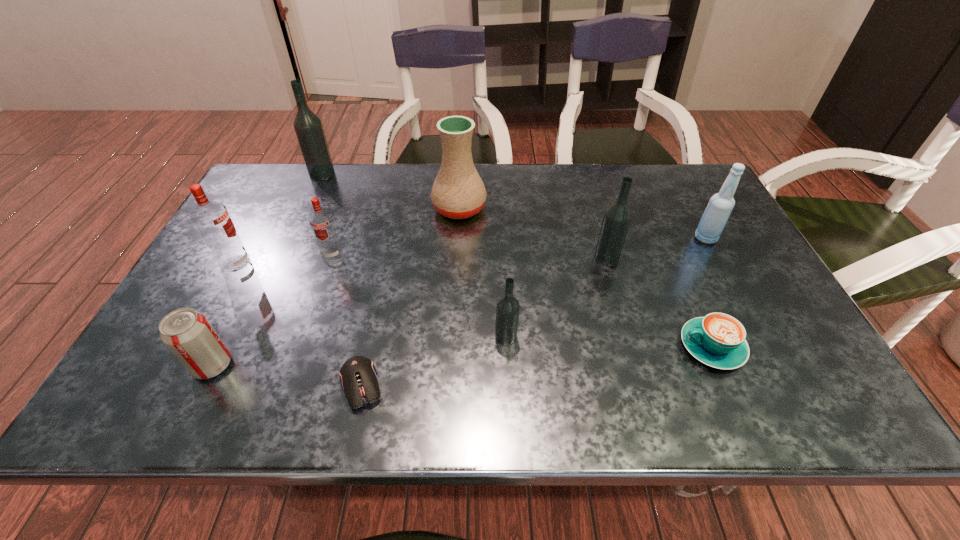
This screenshot has height=540, width=960. Find the location of `the farthest vodka`. the farthest vodka is located at coordinates (308, 127).

At what (x,y) coordinates should I click in order to perform the action: click on the tallest vodka. Please return your answer as a coordinate pair (x, y). The width and height of the screenshot is (960, 540). Looking at the image, I should click on (308, 127).

This screenshot has width=960, height=540. Find the location of `pottery`. pottery is located at coordinates (458, 192).

At what (x,y) coordinates should I click in order to perform the action: click on the ninth nearest object. Please return your answer as a coordinate pair (x, y). This screenshot has width=960, height=540. Looking at the image, I should click on (458, 192).

What are the coordinates of `the rightmost vodka` in the screenshot? It's located at (617, 217).

This screenshot has height=540, width=960. I want to click on the rightmost black vodka, so click(x=617, y=217).

Where is `the leftmost vodka`? the leftmost vodka is located at coordinates (212, 219).

Where is `the left red vodka`? the left red vodka is located at coordinates (212, 219).

I want to click on bottle, so 720,206.

Image resolution: width=960 pixels, height=540 pixels. I want to click on the rightmost object, so click(x=720, y=206).